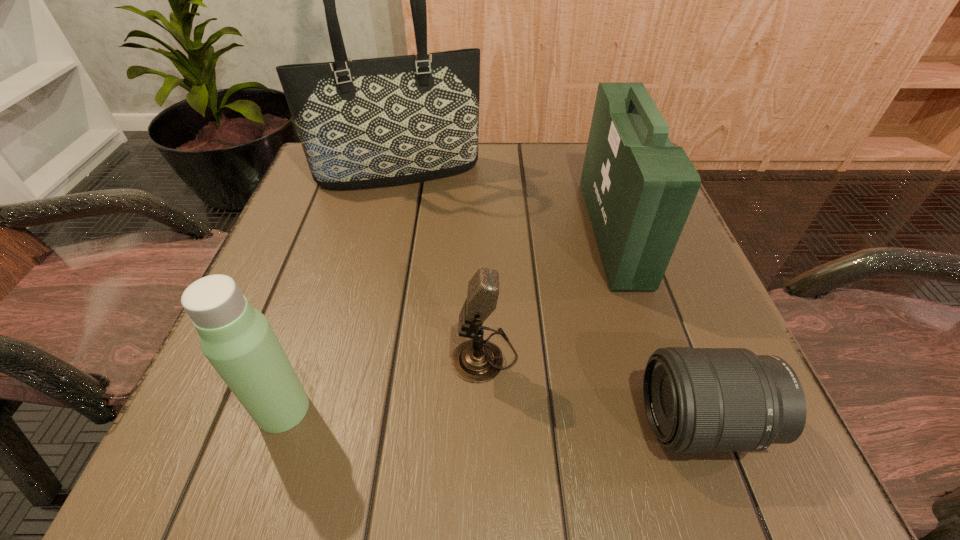
Where is `free location located on the front-facing side of the fourth tallest object`? free location located on the front-facing side of the fourth tallest object is located at coordinates [x=357, y=355].

In order to click on free space located 0.130m on the front-facing side of the fourth tallest object in this screenshot , I will do `click(365, 355)`.

You are a GUI agent. You are given a task and a screenshot of the screen. Output one action in this format:
    pyautogui.click(x=<x>, y=<y>)
    Task: Click on the free space located 0.250m on the front-facing side of the fourth tallest object
    This screenshot has height=540, width=960.
    Given the screenshot: What is the action you would take?
    pyautogui.click(x=283, y=355)

Locate an element on the screen. vacant space located on the surface of the telephoto lens is located at coordinates (561, 422).

The image size is (960, 540). Identify the location of free space located 0.150m on the surface of the telephoto lens. (530, 422).

Find the location of `blank space located on the surface of the telephoto lens`. blank space located on the surface of the telephoto lens is located at coordinates (469, 422).

Identify the location of tote bag that is at the far edge. (375, 122).

Where is `the first-aid kit that is at the far edge`? This screenshot has width=960, height=540. the first-aid kit that is at the far edge is located at coordinates (639, 189).

What are the coordinates of `thermos bottle located at the near edge` in the screenshot? It's located at (237, 339).

The height and width of the screenshot is (540, 960). What are the coordinates of `telephoto lens at the near edge` in the screenshot? It's located at (697, 400).